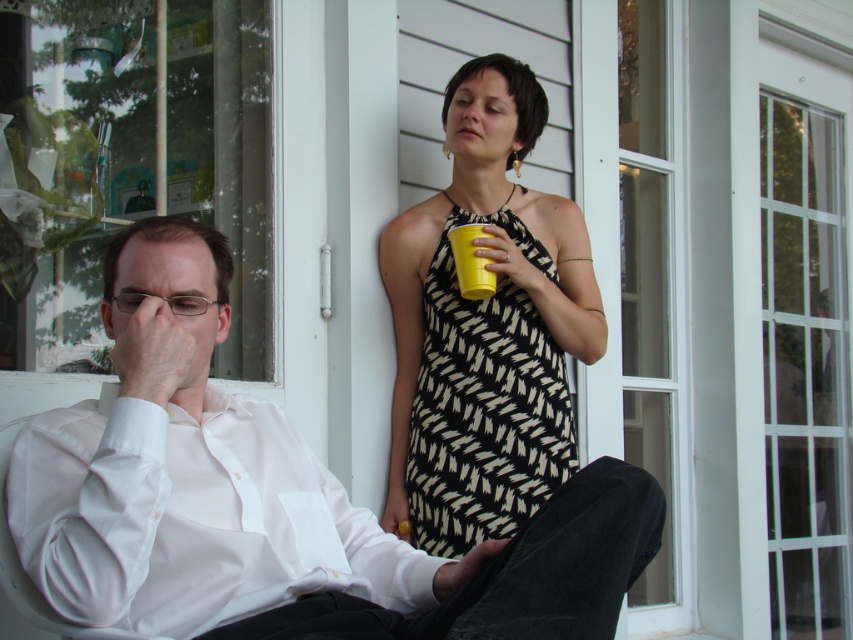
Question: Which point is closer to the camera taking this photo?

Choices:
 (A) (299, 490)
 (B) (178, 513)

Answer: (B)

Question: Does white cotton shirt at left have a lesser width compared to white smooth shirt at left?

Choices:
 (A) no
 (B) yes

Answer: (A)

Question: Does white cotton shirt at left have a smaller size compared to black and white zigzag dress at upper center?

Choices:
 (A) yes
 (B) no

Answer: (B)

Question: Does white cotton shirt at left have a greater width compared to black and white zigzag dress at upper center?

Choices:
 (A) no
 (B) yes

Answer: (B)

Question: Estimate the real-world distances between objects in this image. Which object is closer to the white cotton shirt at left?

Choices:
 (A) black and white zigzag dress at upper center
 (B) white smooth shirt at left

Answer: (B)

Question: Considering the real-world distances, which object is closest to the white cotton shirt at left?

Choices:
 (A) white smooth shirt at left
 (B) black and white zigzag dress at upper center

Answer: (A)